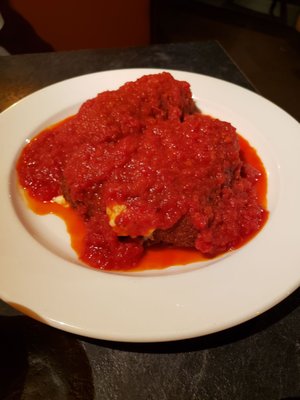
The height and width of the screenshot is (400, 300). Find the location of `white plate`. white plate is located at coordinates (82, 300), (106, 79).